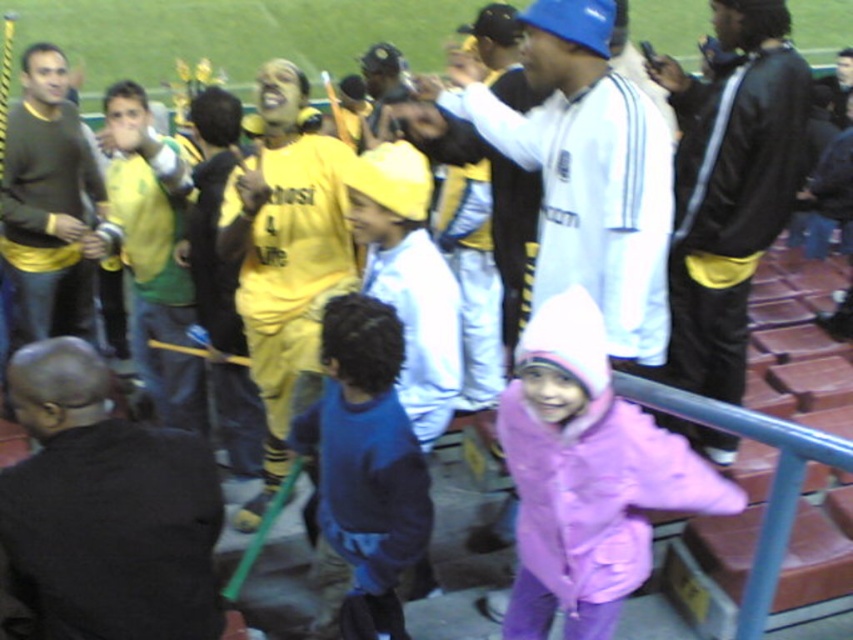
Looking at this image, you are a photographer at the stadium and want to capture a photo of both the blue fleece jacket at center and the light blue hoodie at center in the same frame. Which one should you focus on first to ensure both are in the shot?

The blue fleece jacket at center is located below the light blue hoodie at center, so you should focus on the light blue hoodie at center first to ensure both are in the shot.

Where is the blue fleece jacket at center located in the image?

The blue fleece jacket at center is located at point (364,449).

You are standing at the entrance of the stadium and see the black leather jacket at right in the distance. If you want to reach it quickly, should you walk straight ahead or turn left? Please explain your reasoning based on the jacket

The black leather jacket at right is 3.31 meters away from the viewer. Since it is positioned to the right, you should turn right to approach it more directly rather than walking straight ahead or turning left.